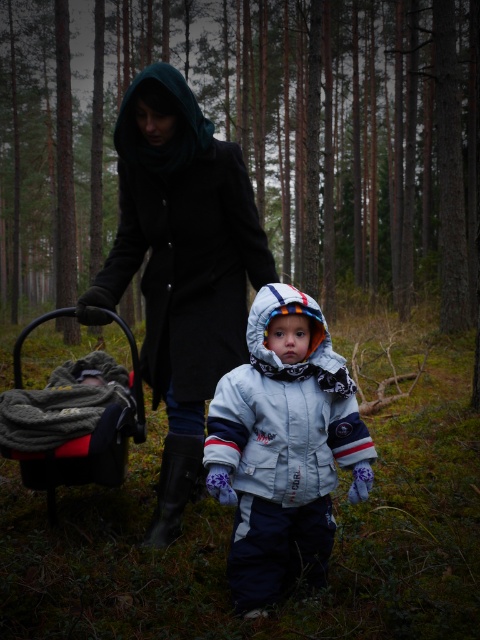
Question: Does light gray fleece snowsuit at center appear on the right side of dark gray fabric baby carriage at lower left?

Choices:
 (A) yes
 (B) no

Answer: (A)

Question: Which point is farther to the camera?

Choices:
 (A) (301, 502)
 (B) (16, 458)
 (C) (154, 54)

Answer: (C)

Question: Which point is farther to the camera?

Choices:
 (A) (323, 371)
 (B) (156, 234)
 (C) (108, 413)

Answer: (B)

Question: Considering the relative positions of green matte pine forest at center and matte black coat at center in the image provided, where is green matte pine forest at center located with respect to matte black coat at center?

Choices:
 (A) below
 (B) above

Answer: (B)

Question: Can you confirm if matte black coat at center is positioned above light gray fleece snowsuit at center?

Choices:
 (A) no
 (B) yes

Answer: (B)

Question: Which of the following is the closest to the observer?

Choices:
 (A) (244, 116)
 (B) (305, 428)
 (C) (148, 177)
 (D) (20, 387)

Answer: (B)